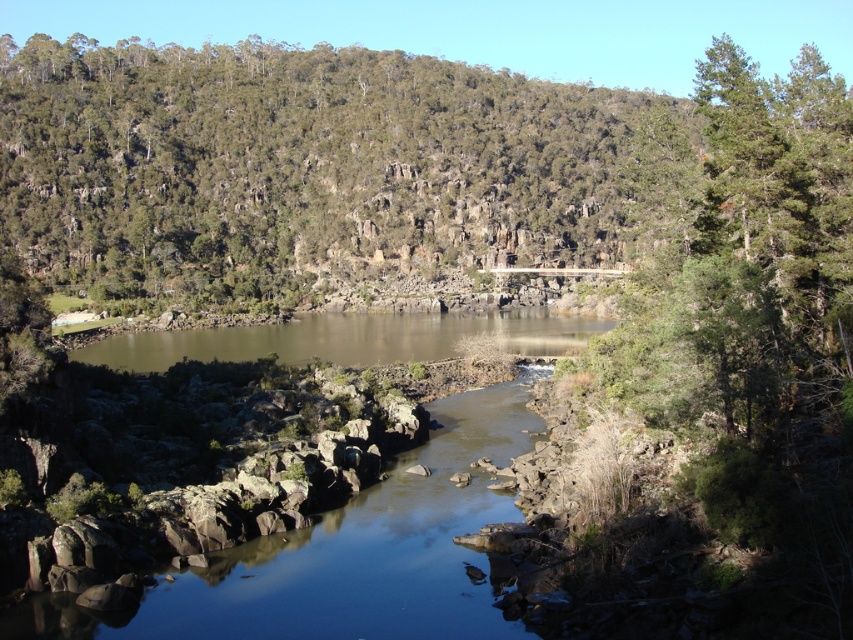
Which of these two, green leafy tree at upper center or brown rock river at center, stands taller?

With more height is green leafy tree at upper center.

Who is more forward, (13, 67) or (204, 330)?

Point (204, 330) is in front.

Is point (183, 100) positioned behind point (231, 353)?

Yes.

Locate an element on the screen. This screenshot has width=853, height=640. green leafy tree at upper center is located at coordinates (312, 168).